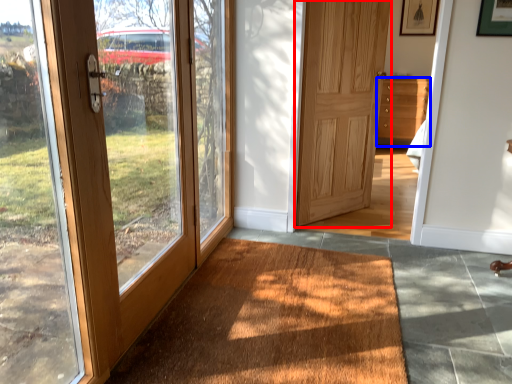
Question: Among these objects, which one is nearest to the camera, door (highlighted by a red box) or chest of drawers (highlighted by a blue box)?

Choices:
 (A) door
 (B) chest of drawers

Answer: (A)